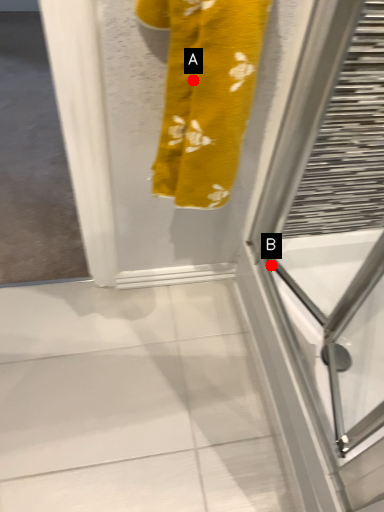
Question: Two points are circled on the image, labeled by A and B beside each circle. Which of the following is the closest to the observer?

Choices:
 (A) A is closer
 (B) B is closer

Answer: (A)